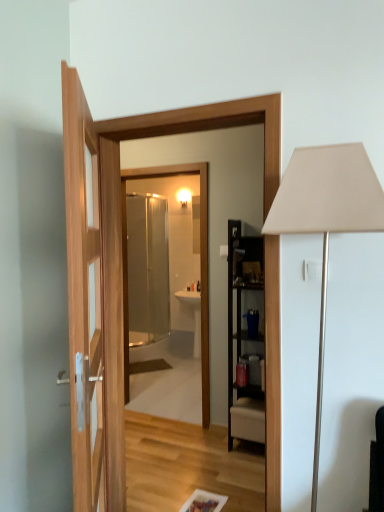
Question: Is white matte table lamp at right shorter than transparent glass mirror at center?

Choices:
 (A) yes
 (B) no

Answer: (A)

Question: Is white matte table lamp at right closer to camera compared to transparent glass mirror at center?

Choices:
 (A) no
 (B) yes

Answer: (B)

Question: Is white matte table lamp at right next to transparent glass mirror at center?

Choices:
 (A) yes
 (B) no

Answer: (B)

Question: Would you say white matte table lamp at right is outside transparent glass mirror at center?

Choices:
 (A) no
 (B) yes

Answer: (B)

Question: Is white matte table lamp at right further to camera compared to transparent glass mirror at center?

Choices:
 (A) yes
 (B) no

Answer: (B)

Question: Is white matte table lamp at right thinner than transparent glass mirror at center?

Choices:
 (A) no
 (B) yes

Answer: (A)

Question: Would you say clear glass shower door at center is part of transparent glass mirror at center's contents?

Choices:
 (A) no
 (B) yes

Answer: (A)

Question: Can you confirm if transparent glass mirror at center is smaller than clear glass shower door at center?

Choices:
 (A) no
 (B) yes

Answer: (B)

Question: Does transparent glass mirror at center have a larger size compared to clear glass shower door at center?

Choices:
 (A) no
 (B) yes

Answer: (A)

Question: From the image's perspective, does transparent glass mirror at center appear lower than clear glass shower door at center?

Choices:
 (A) yes
 (B) no

Answer: (A)

Question: Is transparent glass mirror at center to the right of clear glass shower door at center from the viewer's perspective?

Choices:
 (A) yes
 (B) no

Answer: (A)

Question: Is transparent glass mirror at center far away from clear glass shower door at center?

Choices:
 (A) yes
 (B) no

Answer: (A)

Question: From a real-world perspective, is transparent glass mirror at center positioned under white matte table lamp at right based on gravity?

Choices:
 (A) no
 (B) yes

Answer: (B)